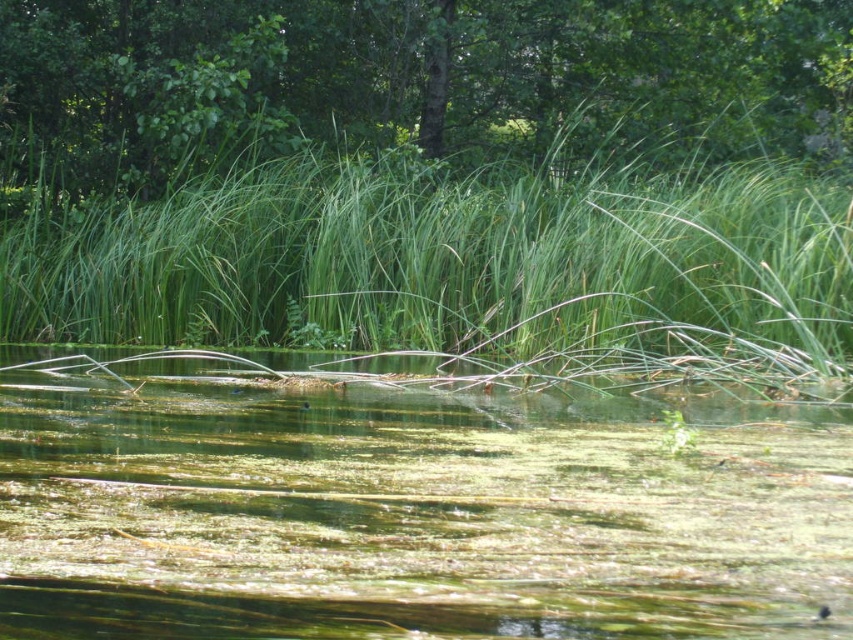
You are standing at the edge of the pond and see two points marked on the water surface. The first point is at coordinates point (608, 528) and the second is at point (546, 67). Which point is closer to you?

Point (608, 528) is closer to you because it is in front of point (546, 67).

You are standing at the edge of the pond and see the green grass at center and the green leafy tree at upper center. Which object is located to the right of the other?

The green grass at center is positioned on the left side of green leafy tree at upper center, so the green leafy tree at upper center is to the right of the green grass at center.